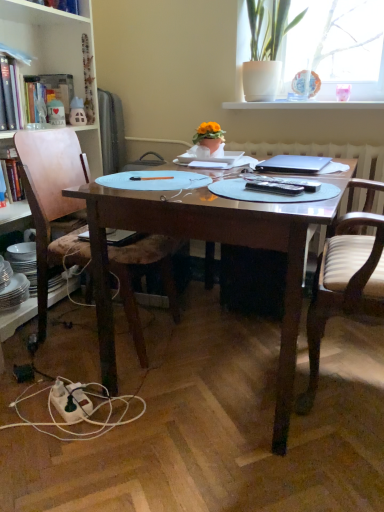
Locate an element on the screen. empty space that is to the right of white plastic power outlet at lower left is located at coordinates (125, 409).